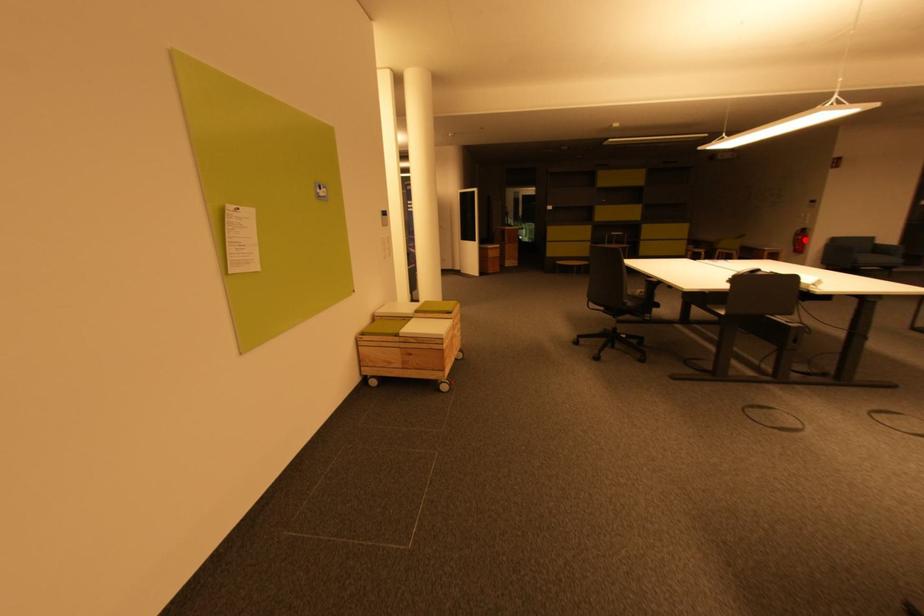
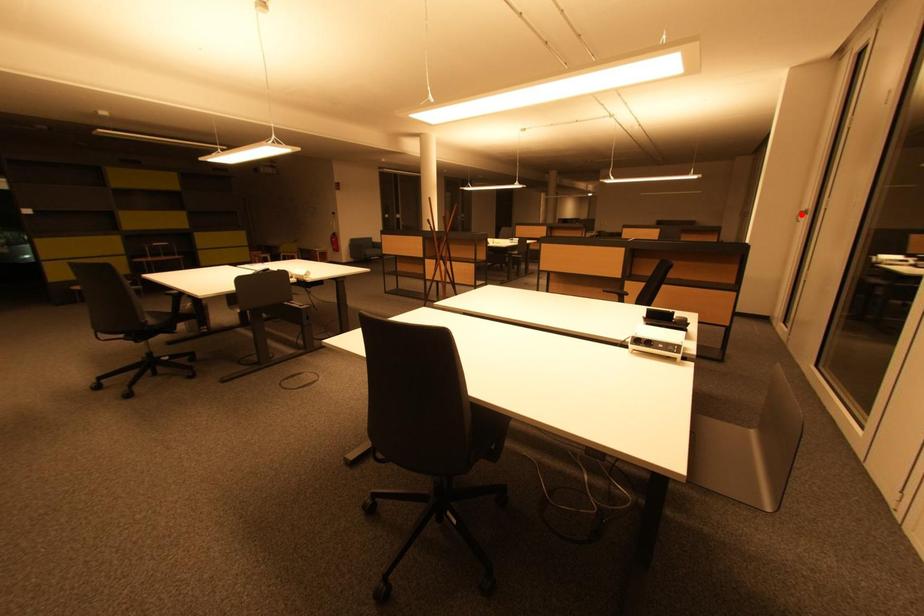
I am providing you with two images of the same scene from different viewpoints. A red point is marked on the first image and another point is marked on the second image. Do the highlighted points in image1 and image2 indicate the same real-world spot?

No